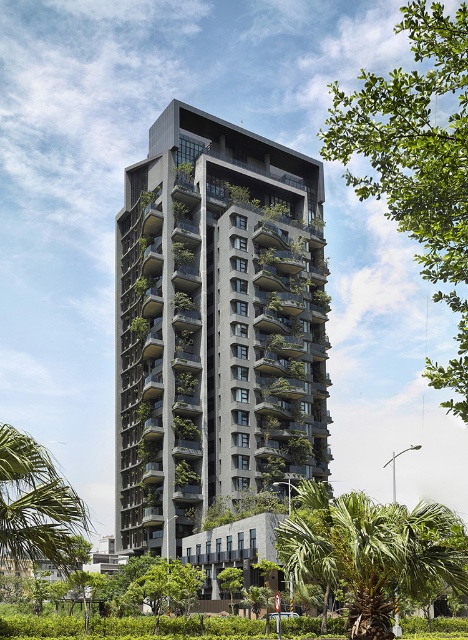
Looking at this image, who is more forward, (x=203, y=404) or (x=448, y=582)?

Point (x=448, y=582) is more forward.

Which is below, dark gray concrete building at center or green leafy palm tree at lower right?

Positioned lower is green leafy palm tree at lower right.

Which is behind, point (184, 362) or point (440, 508)?

The point (184, 362) is behind.

Find the location of a particular element. This screenshot has height=640, width=468. dark gray concrete building at center is located at coordinates (216, 324).

Does dark gray concrete building at center appear over green leafy palm tree at lower left?

Yes, dark gray concrete building at center is above green leafy palm tree at lower left.

Does point (155, 385) lie behind point (60, 524)?

Yes, it is behind point (60, 524).

At what (x,y) coordinates should I click in order to perform the action: click on dark gray concrete building at center. Please return your answer as a coordinate pair (x, y). This screenshot has width=468, height=640. Looking at the image, I should click on [x=216, y=324].

Can you confirm if green leafy tree at upper right is positioned below green leafy palm tree at lower right?

Actually, green leafy tree at upper right is above green leafy palm tree at lower right.

Can you confirm if green leafy tree at upper right is thinner than green leafy palm tree at lower right?

In fact, green leafy tree at upper right might be wider than green leafy palm tree at lower right.

I want to click on green leafy tree at upper right, so click(414, 140).